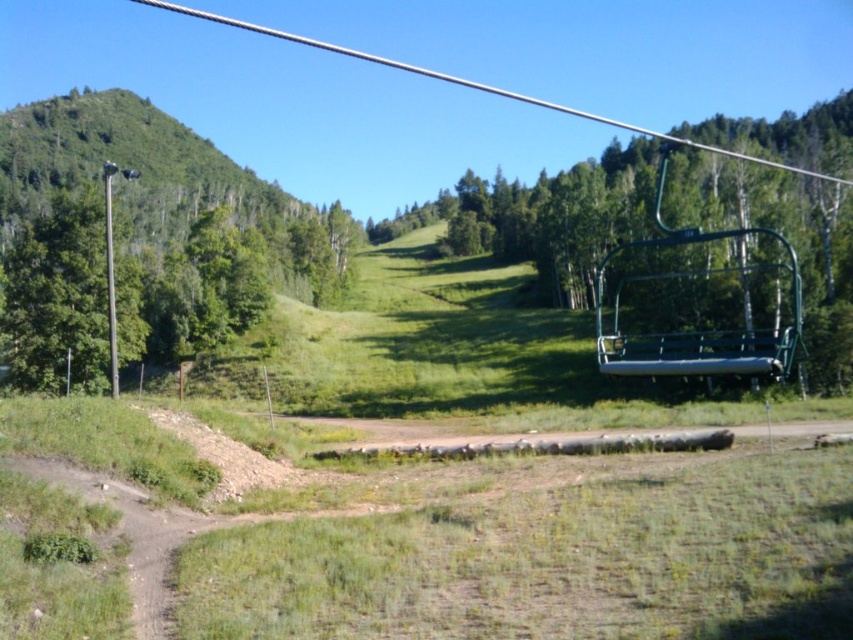
Question: Does green leafy tree at left appear on the right side of metallic pole at left?

Choices:
 (A) yes
 (B) no

Answer: (A)

Question: Where is green metal chair at upper right located in relation to green leafy tree at left in the image?

Choices:
 (A) below
 (B) above

Answer: (B)

Question: Which of these objects is positioned farthest from the green metal chair at upper right?

Choices:
 (A) green leafy tree at left
 (B) metallic pole at left

Answer: (B)

Question: Which object is closer to the camera taking this photo?

Choices:
 (A) metallic pole at left
 (B) green metal chair at upper right

Answer: (B)

Question: Which point is closer to the camera?

Choices:
 (A) green metal chair at upper right
 (B) metallic pole at left
 (C) green leafy tree at left

Answer: (A)

Question: Does green leafy tree at left appear on the left side of metallic pole at left?

Choices:
 (A) yes
 (B) no

Answer: (B)